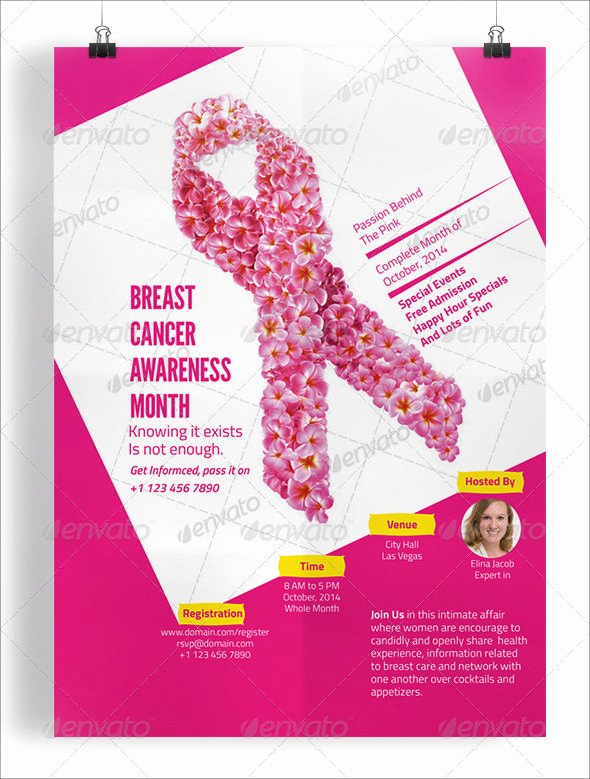
The width and height of the screenshot is (590, 779). In order to click on binder clips in this screenshot , I will do `click(100, 46)`, `click(496, 47)`.